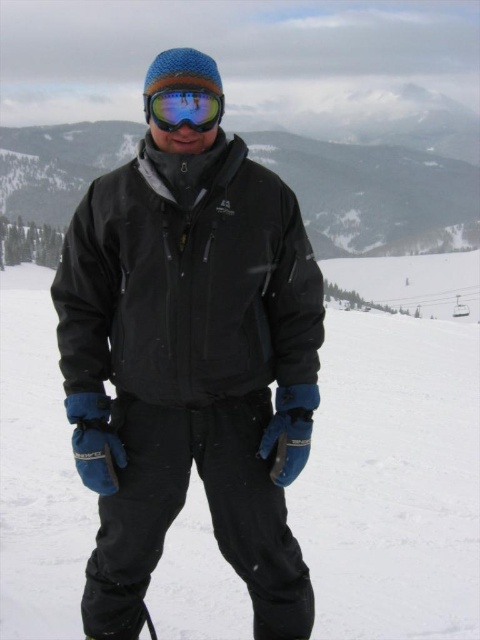
Between black softshell jacket at center and glossy plastic goggles at center, which one appears on the left side from the viewer's perspective?

Positioned to the left is black softshell jacket at center.

Does point (122, 618) lie behind point (222, 99)?

No, it is in front of (222, 99).

Find the location of a particular element. The image size is (480, 640). black softshell jacket at center is located at coordinates (191, 369).

Which is in front, point (275, 589) or point (410, 636)?

Point (275, 589)

Between black softshell jacket at center and white matte snow at center, which one has less height?

With less height is black softshell jacket at center.

Is point (154, 400) positioned after point (17, 548)?

No, it is not.

Where is `black softshell jacket at center`? This screenshot has width=480, height=640. black softshell jacket at center is located at coordinates (191, 369).

The width and height of the screenshot is (480, 640). What do you see at coordinates (394, 477) in the screenshot?
I see `white matte snow at center` at bounding box center [394, 477].

Who is more distant from viewer, (343, 554) or (168, 129)?

Point (343, 554)

Identify the location of white matte snow at center. (394, 477).